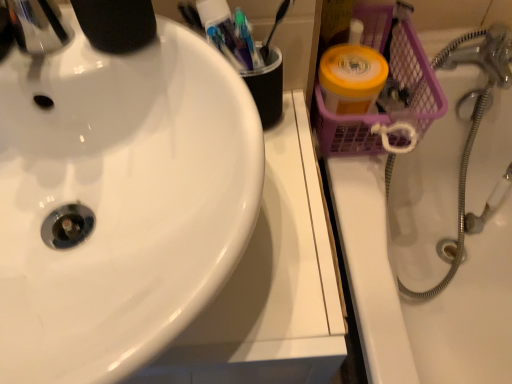
Question: From the image's perspective, is purple mesh basket at upper right located above white glossy sink at left?

Choices:
 (A) no
 (B) yes

Answer: (A)

Question: Is purple mesh basket at upper right next to white glossy sink at left?

Choices:
 (A) no
 (B) yes

Answer: (A)

Question: From a real-world perspective, is purple mesh basket at upper right physically above white glossy sink at left?

Choices:
 (A) yes
 (B) no

Answer: (B)

Question: Is purple mesh basket at upper right at the left side of white glossy sink at left?

Choices:
 (A) no
 (B) yes

Answer: (A)

Question: Is purple mesh basket at upper right taller than white glossy sink at left?

Choices:
 (A) yes
 (B) no

Answer: (A)

Question: Is purple mesh basket at upper right outside of white glossy sink at left?

Choices:
 (A) no
 (B) yes

Answer: (B)

Question: Does white glossy sink at left have a smaller size compared to purple mesh basket at upper right?

Choices:
 (A) yes
 (B) no

Answer: (A)

Question: Considering the relative sizes of white glossy sink at left and purple mesh basket at upper right in the image provided, is white glossy sink at left taller than purple mesh basket at upper right?

Choices:
 (A) no
 (B) yes

Answer: (A)

Question: Is white glossy sink at left facing towards purple mesh basket at upper right?

Choices:
 (A) yes
 (B) no

Answer: (B)

Question: Is white glossy sink at left bigger than purple mesh basket at upper right?

Choices:
 (A) no
 (B) yes

Answer: (A)

Question: Considering the relative sizes of white glossy sink at left and purple mesh basket at upper right in the image provided, is white glossy sink at left shorter than purple mesh basket at upper right?

Choices:
 (A) yes
 (B) no

Answer: (A)

Question: Is the surface of white glossy sink at left in direct contact with purple mesh basket at upper right?

Choices:
 (A) yes
 (B) no

Answer: (B)

Question: Looking at the image, does white glossy sink at left seem bigger or smaller compared to purple mesh basket at upper right?

Choices:
 (A) big
 (B) small

Answer: (B)